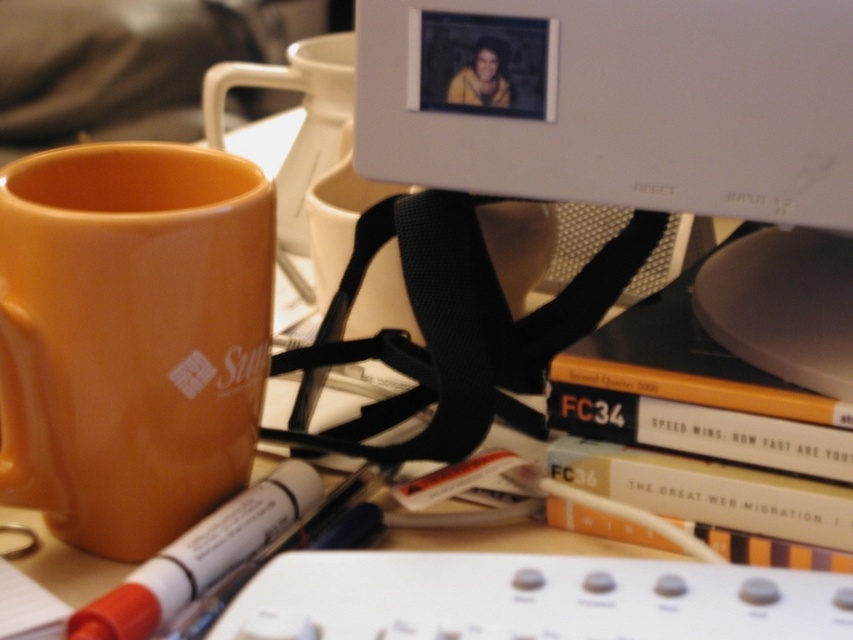
Between matte orange mug at left and hardcover book at center, which one is positioned lower?

hardcover book at center is lower down.

Between matte orange mug at left and hardcover book at center, which one is positioned higher?

matte orange mug at left

Is point (183, 163) closer to viewer compared to point (699, 506)?

No, it is behind (699, 506).

Find the location of a particular element. This screenshot has width=853, height=640. matte orange mug at left is located at coordinates (131, 337).

Is hardcover book at center taller than white matte marker at lower left?

In fact, hardcover book at center may be shorter than white matte marker at lower left.

I want to click on hardcover book at center, so click(708, 492).

Image resolution: width=853 pixels, height=640 pixels. I want to click on hardcover book at center, so click(x=708, y=492).

You are a GUI agent. You are given a task and a screenshot of the screen. Output one action in this format:
    pyautogui.click(x=<x>, y=<y>)
    Task: Click on the hardcover book at center
    This screenshot has width=853, height=640.
    Given the screenshot: What is the action you would take?
    pyautogui.click(x=708, y=492)

Where is `white matte computer monitor at upper center`? The image size is (853, 640). white matte computer monitor at upper center is located at coordinates (614, 102).

What are the coordinates of `white matte computer monitor at upper center` in the screenshot? It's located at (614, 102).